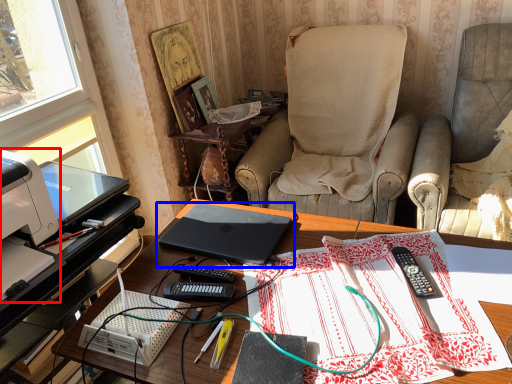
Question: Which of the following is the farthest to the observer, printer (highlighted by a red box) or laptop (highlighted by a blue box)?

Choices:
 (A) printer
 (B) laptop

Answer: (B)